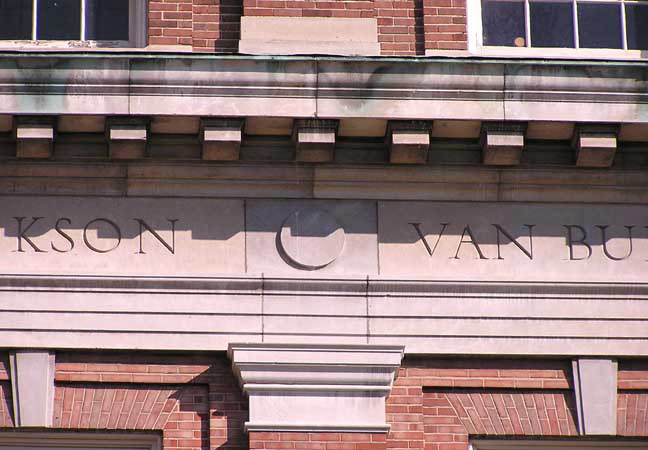
Locate an element on the screen. ledge is located at coordinates (308, 104).